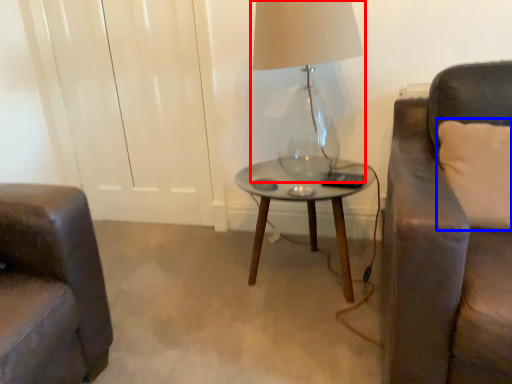
Question: Which object appears farthest to the camera in this image, lamp (highlighted by a red box) or pillow (highlighted by a blue box)?

Choices:
 (A) lamp
 (B) pillow

Answer: (A)